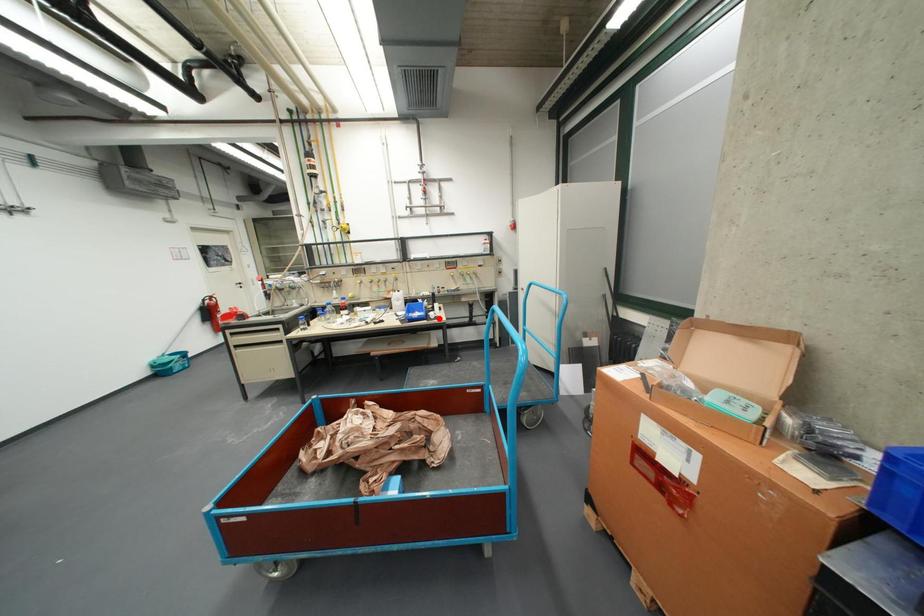
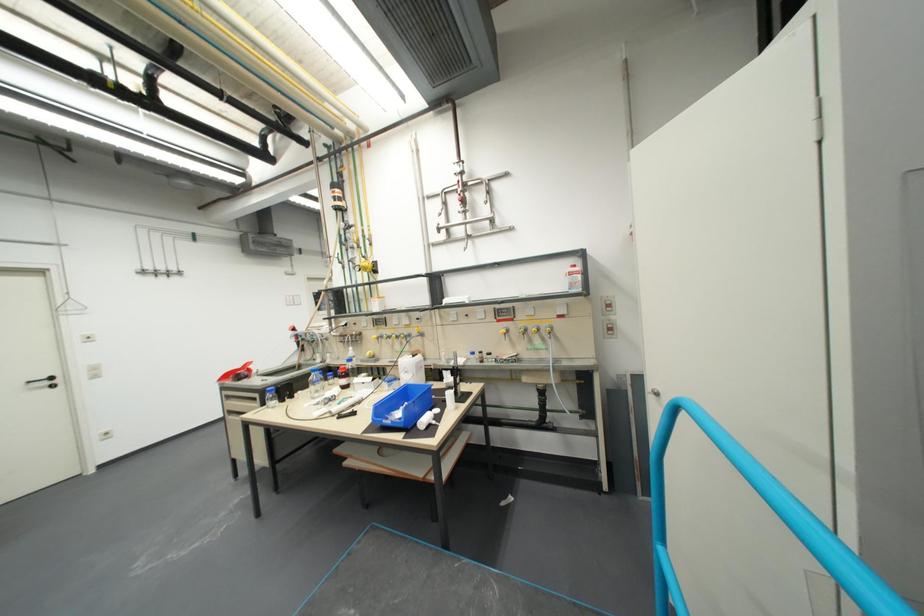
The point at the highlighted location is marked in the first image. Where is the corresponding point in the second image?

(420, 428)